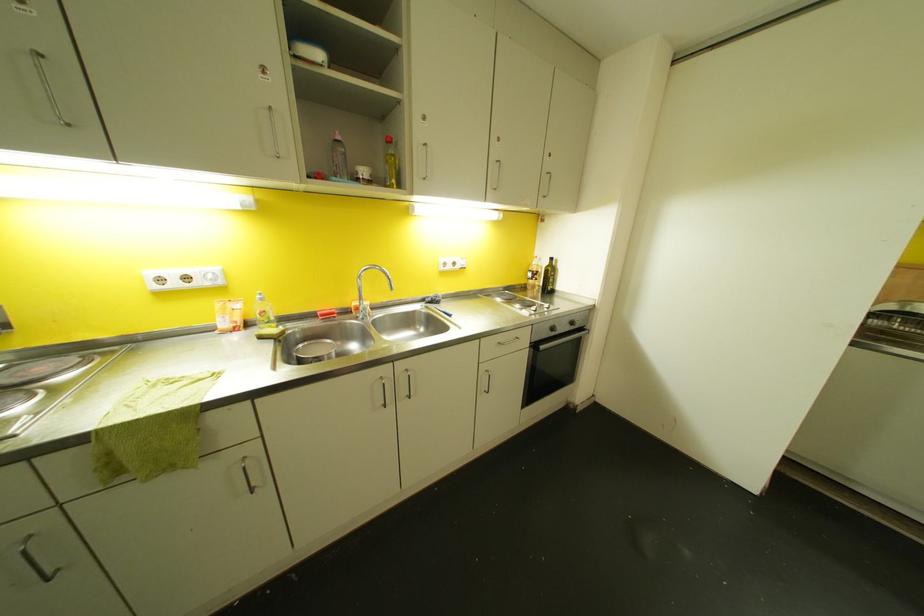
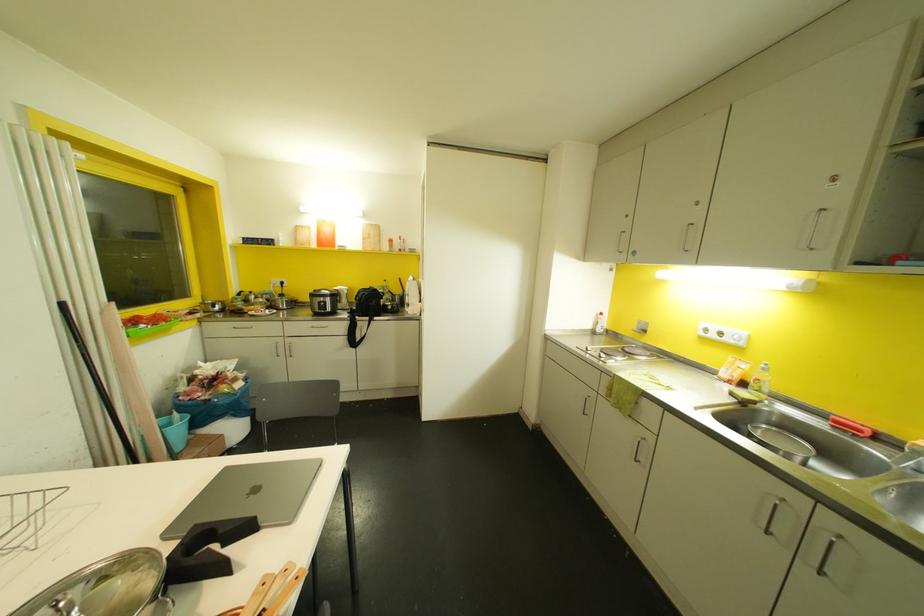
Based on the continuous images, in which direction is the camera rotating?

The camera rotated toward left-down.